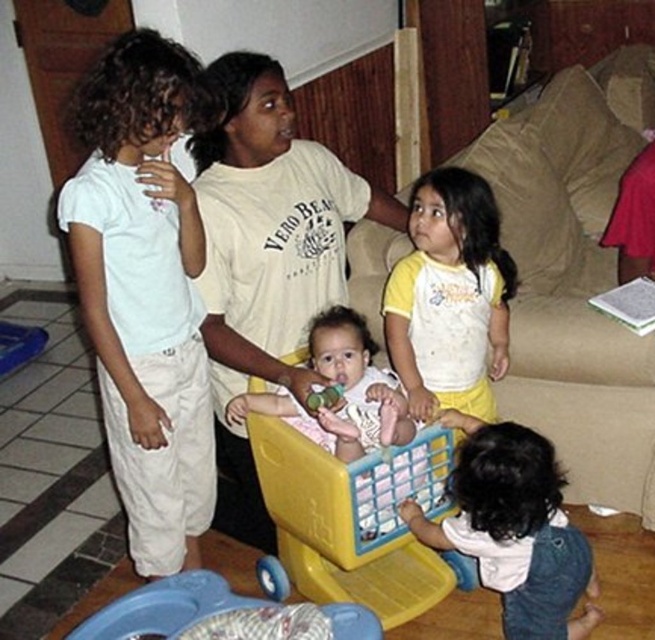
Question: Can you confirm if yellow cotton shirt at center is positioned below blue plastic walker at lower left?

Choices:
 (A) yes
 (B) no

Answer: (B)

Question: Is white cotton shirt at lower right wider than blue plastic walker at lower left?

Choices:
 (A) no
 (B) yes

Answer: (A)

Question: In this image, where is white cotton pants at left located relative to soft white baby at center?

Choices:
 (A) below
 (B) above

Answer: (B)

Question: Which object is positioned closest to the yellow cotton shirt at center?

Choices:
 (A) white cotton shirt at lower right
 (B) soft white baby at center
 (C) yellow plastic shopping cart at center
 (D) white cotton pants at left

Answer: (B)

Question: Which point appears farthest from the camera in this image?

Choices:
 (A) [460, 188]
 (B) [312, 348]

Answer: (A)

Question: Which object is the farthest from the yellow plastic shopping cart at center?

Choices:
 (A) blue plastic walker at lower left
 (B) white cotton shirt at lower right
 (C) white cotton pants at left

Answer: (C)